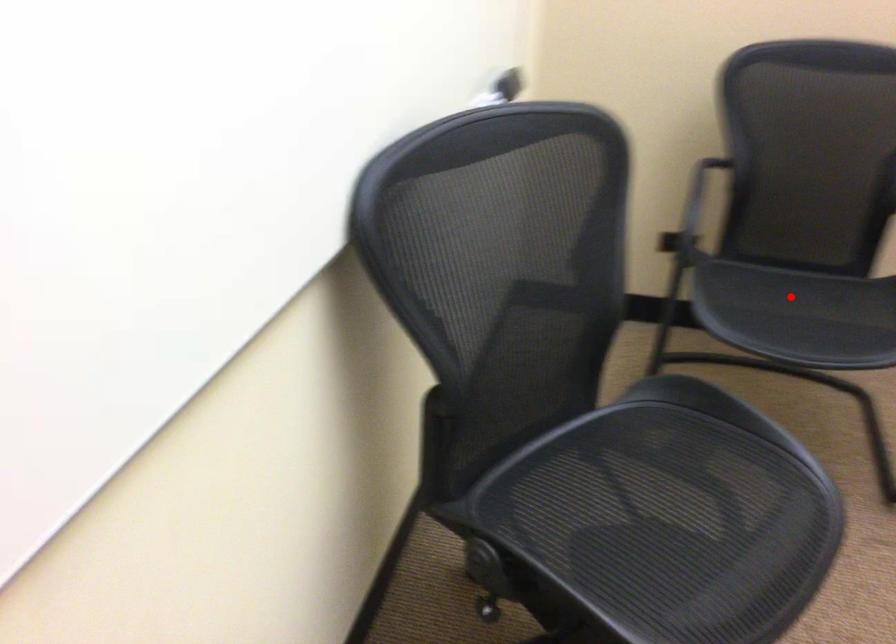
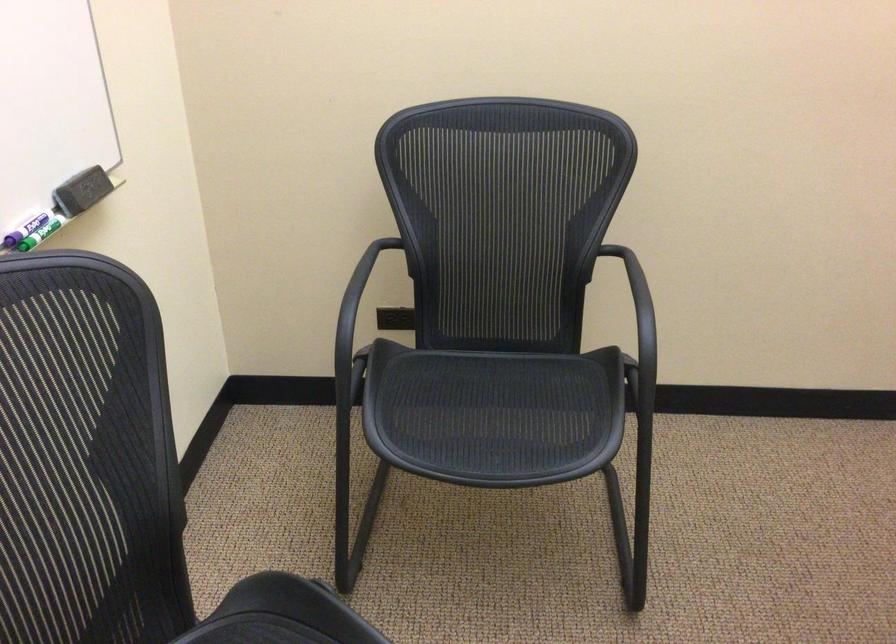
In the second image, find the point that corresponds to the highlighted location in the first image.

(478, 413)